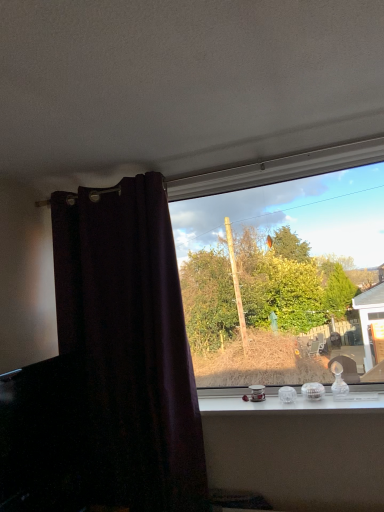
Where is `empty space that is ontop of clear glass ornaments at center (from a real-world perspective)`? The width and height of the screenshot is (384, 512). empty space that is ontop of clear glass ornaments at center (from a real-world perspective) is located at coordinates (281, 399).